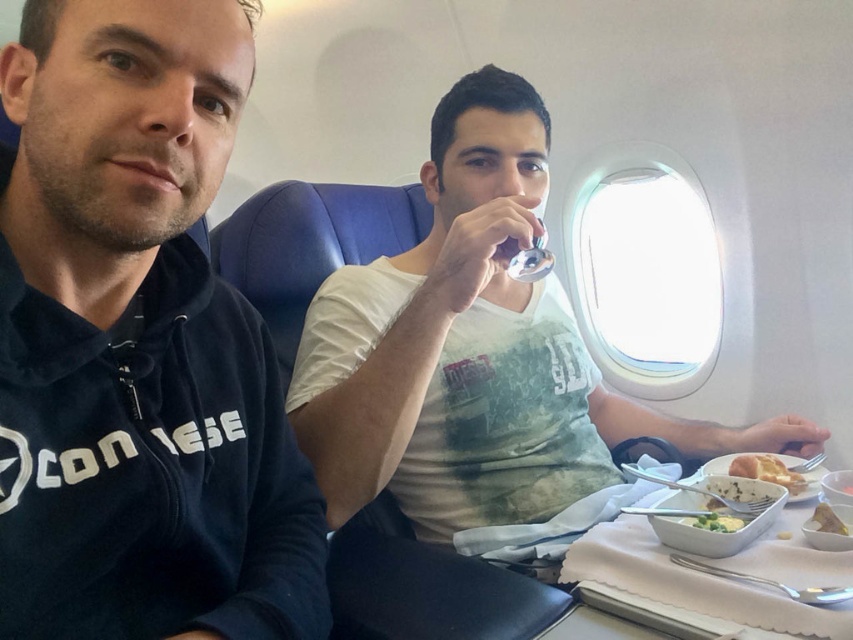
Question: Estimate the real-world distances between objects in this image. Which object is farther from the white matte bread at lower right?

Choices:
 (A) golden bread at right
 (B) white plastic tray at lower right
 (C) white matte food at center
 (D) transparent glass airplane window at center

Answer: (D)

Question: Which object is the farthest from the white matte food at center?

Choices:
 (A) transparent glass airplane window at center
 (B) white cotton shirt at center
 (C) white creamy bowl at lower center

Answer: (A)

Question: Which point is closer to the camera taking this photo?

Choices:
 (A) (676, 317)
 (B) (740, 458)
 (C) (718, 513)

Answer: (C)

Question: Can you confirm if transparent glass airplane window at center is wider than white matte bread at lower right?

Choices:
 (A) no
 (B) yes

Answer: (B)

Question: Is black fleece hoodie at left smaller than transparent glass airplane window at center?

Choices:
 (A) yes
 (B) no

Answer: (A)

Question: Can you confirm if transparent glass airplane window at center is positioned to the right of white matte bread at lower right?

Choices:
 (A) yes
 (B) no

Answer: (A)